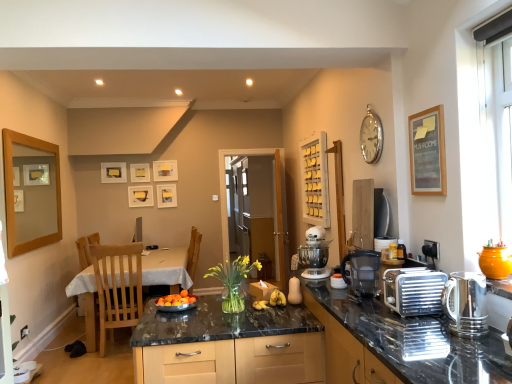
Identify the location of vacant area on top of black marble countertop at center (from a real-world perspective). (220, 308).